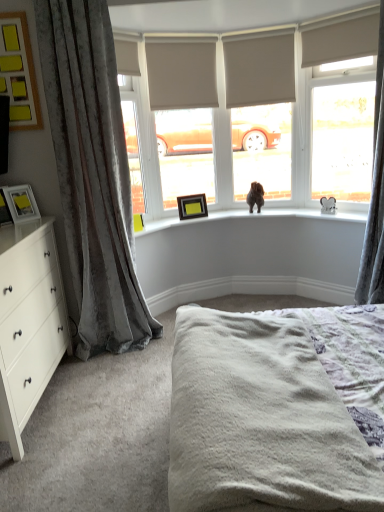
This screenshot has width=384, height=512. Find the location of `free point to the right of brown furry dog at center, which is the 2th animal in front-to-back order`. free point to the right of brown furry dog at center, which is the 2th animal in front-to-back order is located at coordinates (278, 212).